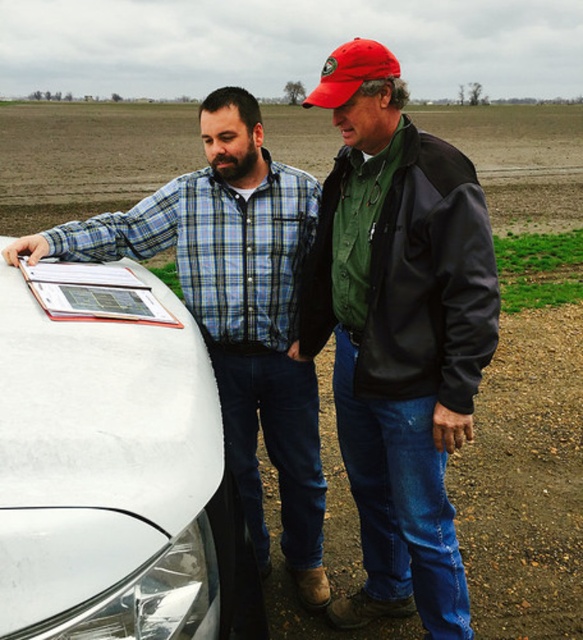
Question: Does green matte jacket at center have a smaller size compared to matte black shirt at left?

Choices:
 (A) yes
 (B) no

Answer: (A)

Question: Is green matte jacket at center positioned in front of matte black shirt at left?

Choices:
 (A) no
 (B) yes

Answer: (A)

Question: Among these objects, which one is farthest from the camera?

Choices:
 (A) green matte jacket at center
 (B) matte black shirt at left

Answer: (A)

Question: Which point is closer to the camera?

Choices:
 (A) green matte jacket at center
 (B) matte black shirt at left

Answer: (B)

Question: Does green matte jacket at center come in front of matte black shirt at left?

Choices:
 (A) no
 (B) yes

Answer: (A)